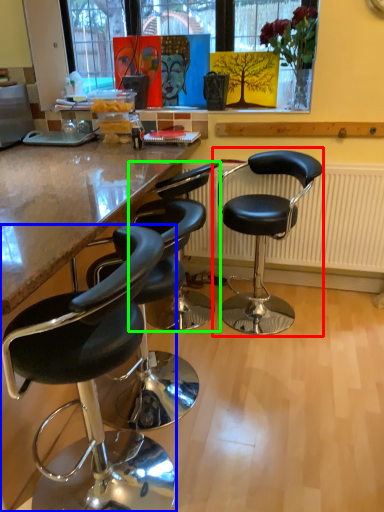
Question: Which object is positioned closest to chair (highlighted by a red box)? Select from chair (highlighted by a blue box) and chair (highlighted by a green box).

Choices:
 (A) chair
 (B) chair

Answer: (B)